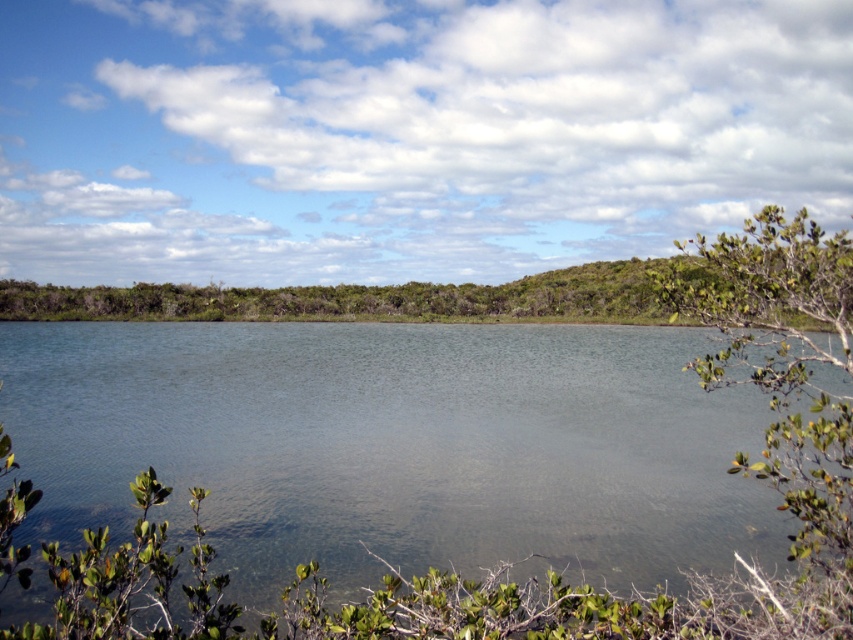
Question: Does clear water at center appear on the right side of green leafy shrub at right?

Choices:
 (A) yes
 (B) no

Answer: (B)

Question: Which of the following is the closest to the observer?

Choices:
 (A) green leafy shrub at right
 (B) clear water at center

Answer: (A)

Question: From the image, what is the correct spatial relationship of clear water at center in relation to green leafy shrub at right?

Choices:
 (A) below
 (B) above

Answer: (A)

Question: Among these objects, which one is farthest from the camera?

Choices:
 (A) clear water at center
 (B) green leafy shrub at right

Answer: (A)

Question: Does clear water at center appear on the left side of green leafy shrub at right?

Choices:
 (A) no
 (B) yes

Answer: (B)